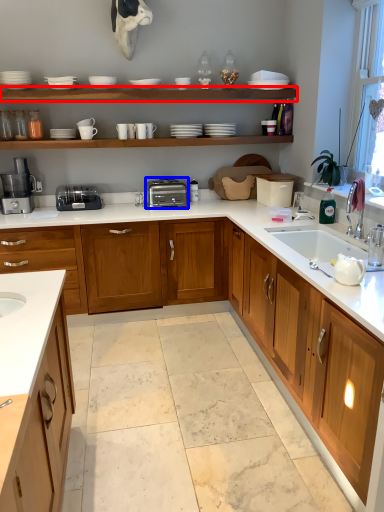
Question: Which of the following is the closest to the observer, shelf (highlighted by a red box) or toaster (highlighted by a blue box)?

Choices:
 (A) shelf
 (B) toaster

Answer: (A)